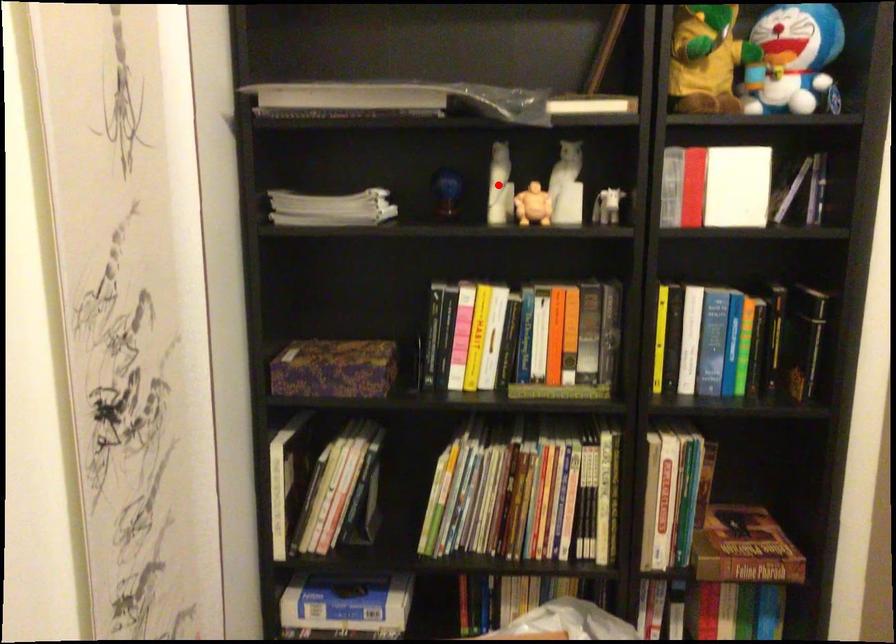
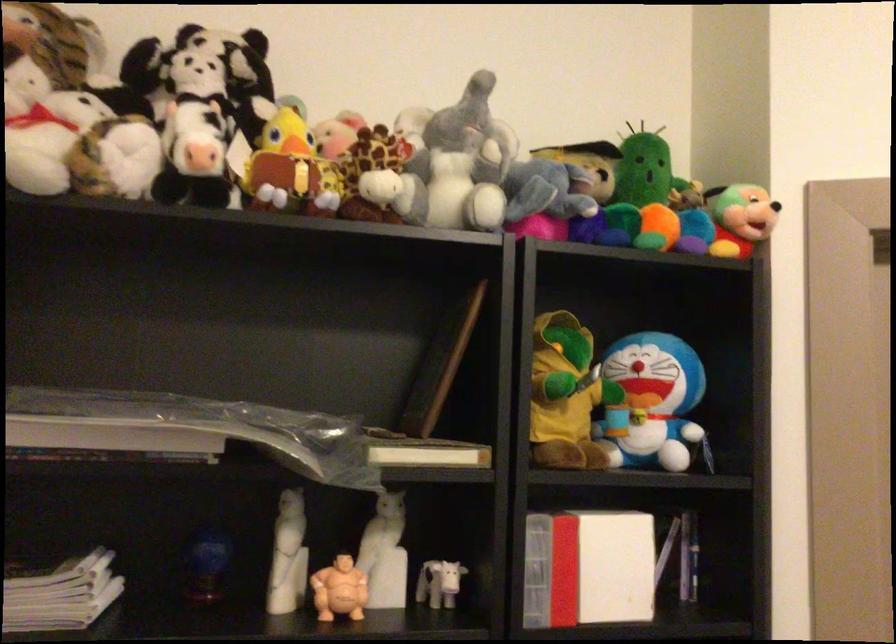
Find the pixel in the second image that matches the highlighted location in the first image.

(288, 556)